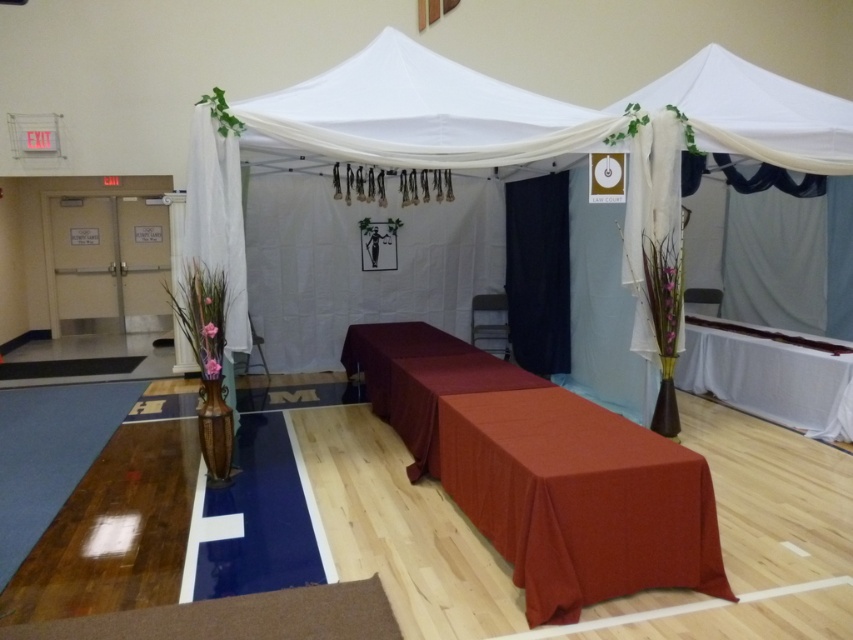
You are organizing a banquet and have two tablecloths available. The matte red tablecloth at center and the burgundy satin tablecloth at center. Which tablecloth would you choose if you want to cover a larger table?

The matte red tablecloth at center has a larger size compared to the burgundy satin tablecloth at center, so it would be the better choice for covering a larger table.

Consider the image. You are organizing an event and need to place a 2.5 meter long banner. The banner must be placed under the white fabric tent at center or on the matte red tablecloth at center. Which location can accommodate the banner without folding it?

The white fabric tent at center is larger in size than the matte red tablecloth at center, so the banner can be placed under the white fabric tent at center without folding it.

Consider the image. You are standing at the camera position in the gymnasium. There is a point marked at coordinates point (682, 333). Can you reach this point by walking straight forward from your current position?

The distance between point (682, 333) and the camera is 15.86 feet. Since you can walk straight forward, you can reach the point by moving 15.86 feet in that direction.